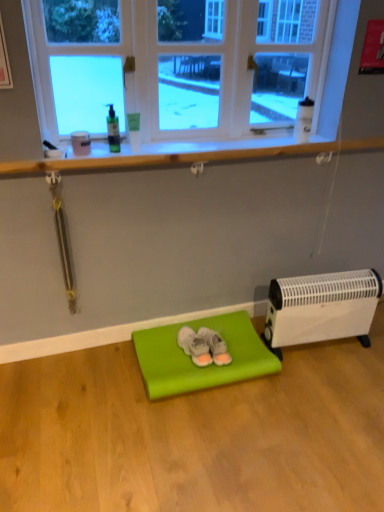
Image resolution: width=384 pixels, height=512 pixels. In order to click on free space on the front side of gray suede slippers at center, acting as the 2th footwear starting from the right in this screenshot , I will do `click(192, 373)`.